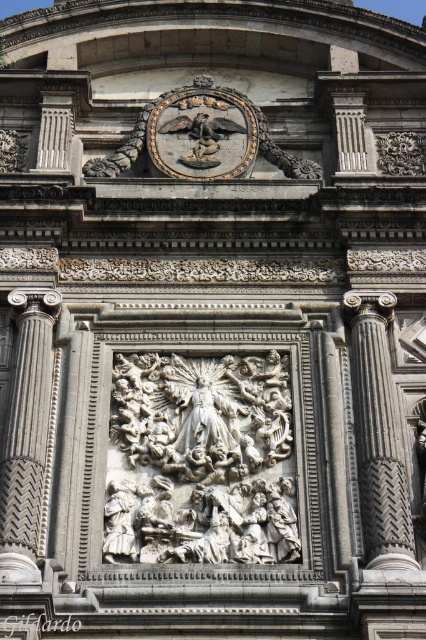
Does point (373, 410) come farther from viewer compared to point (199, 92)?

No.

Does gray textured column at center-right have a smaller size compared to gold metallic angel at upper center?

Indeed, gray textured column at center-right has a smaller size compared to gold metallic angel at upper center.

Between point (389, 305) and point (201, 100), which one is positioned in front?

Positioned in front is point (389, 305).

Image resolution: width=426 pixels, height=640 pixels. What are the coordinates of `gray textured column at center-right` in the screenshot? It's located at (379, 435).

Does gray textured column at center-right appear on the right side of gray stone column at left?

Yes, gray textured column at center-right is to the right of gray stone column at left.

Is gray textured column at center-right above gray stone column at left?

Yes.

Is point (385, 314) positioned after point (39, 480)?

That is True.

This screenshot has width=426, height=640. What are the coordinates of `gray textured column at center-right` in the screenshot? It's located at (379, 435).

Is white marble sculpture at center below gray stone column at left?

Indeed, white marble sculpture at center is positioned under gray stone column at left.

Describe the element at coordinates (201, 460) in the screenshot. I see `white marble sculpture at center` at that location.

Which is behind, point (222, 506) or point (11, 573)?

The point (222, 506) is behind.

Identify the location of white marble sculpture at center. [201, 460].